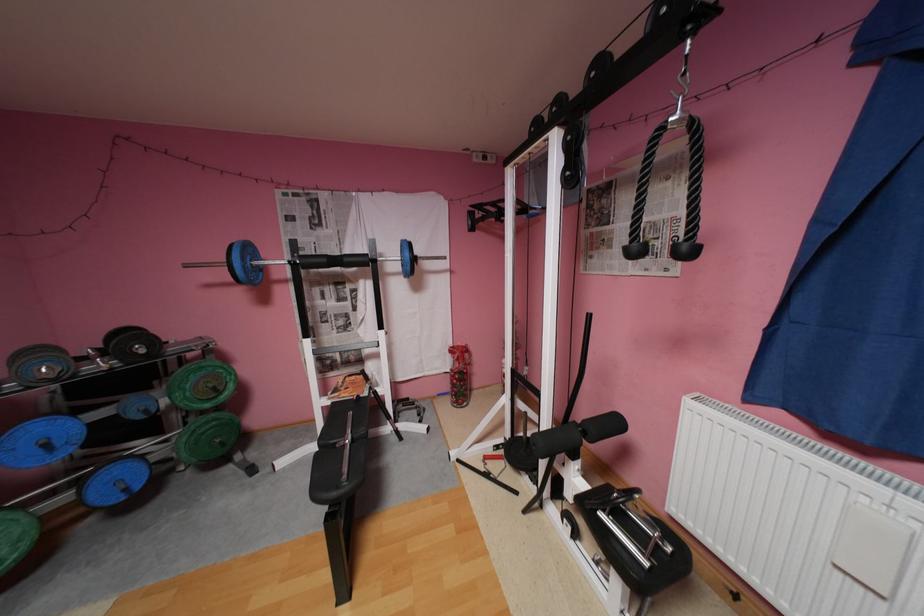
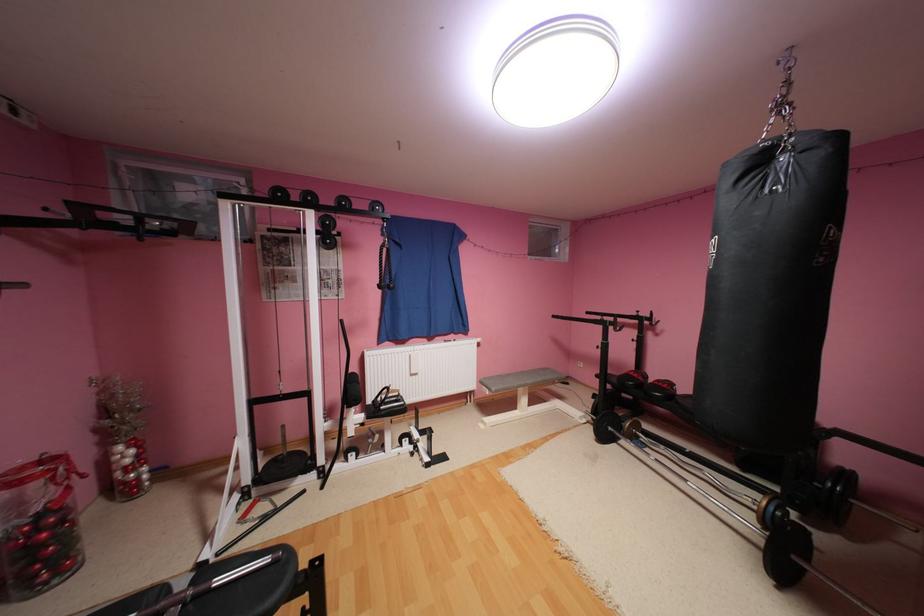
Locate, in the second image, the point that corresponds to [490,214] in the first image.

(78, 216)